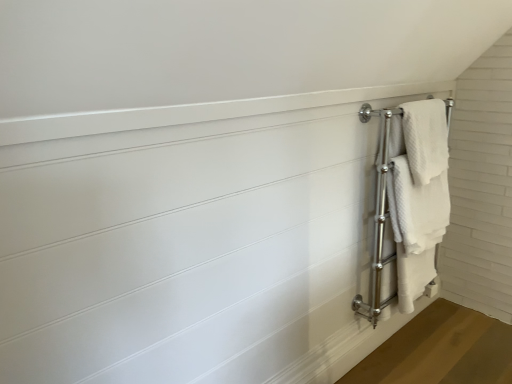
Question: From a real-world perspective, is white textured towel at right on top of white textured towel at right, which is counted as the first bath towel, starting from the bottom?

Choices:
 (A) yes
 (B) no

Answer: (A)

Question: Considering the relative sizes of white textured towel at right and white textured towel at right, which is counted as the first bath towel, starting from the bottom, in the image provided, is white textured towel at right bigger than white textured towel at right, which is counted as the first bath towel, starting from the bottom,?

Choices:
 (A) no
 (B) yes

Answer: (A)

Question: Considering the relative sizes of white textured towel at right and white textured towel at right, which is counted as the first bath towel, starting from the bottom, in the image provided, is white textured towel at right smaller than white textured towel at right, which is counted as the first bath towel, starting from the bottom,?

Choices:
 (A) no
 (B) yes

Answer: (B)

Question: Considering the relative positions of white textured towel at right and white textured towel at right, acting as the 2th bath towel starting from the top, in the image provided, is white textured towel at right to the right of white textured towel at right, acting as the 2th bath towel starting from the top, from the viewer's perspective?

Choices:
 (A) no
 (B) yes

Answer: (B)

Question: Does white textured towel at right lie in front of white textured towel at right, acting as the 2th bath towel starting from the top?

Choices:
 (A) no
 (B) yes

Answer: (A)

Question: Could you tell me if white textured towel at right is facing white textured towel at right, which is counted as the first bath towel, starting from the bottom?

Choices:
 (A) no
 (B) yes

Answer: (B)

Question: Is white textured towel at right, acting as the 2th bath towel starting from the top, not inside white textured towel at right, the second bath towel ordered from the bottom?

Choices:
 (A) yes
 (B) no

Answer: (A)

Question: From the image's perspective, does white textured towel at right, acting as the 2th bath towel starting from the top, appear higher than white textured towel at right, the 1th bath towel in the top-to-bottom sequence?

Choices:
 (A) yes
 (B) no

Answer: (B)

Question: Considering the relative positions of white textured towel at right, which is counted as the first bath towel, starting from the bottom, and white textured towel at right, the 1th bath towel in the top-to-bottom sequence, in the image provided, is white textured towel at right, which is counted as the first bath towel, starting from the bottom, behind white textured towel at right, the 1th bath towel in the top-to-bottom sequence,?

Choices:
 (A) no
 (B) yes

Answer: (A)

Question: Are white textured towel at right, which is counted as the first bath towel, starting from the bottom, and white textured towel at right, the second bath towel ordered from the bottom, making contact?

Choices:
 (A) yes
 (B) no

Answer: (B)

Question: Is white textured towel at right, the second bath towel ordered from the bottom, completely or partially inside white textured towel at right, acting as the 2th bath towel starting from the top?

Choices:
 (A) yes
 (B) no

Answer: (A)

Question: Does white textured towel at right, which is counted as the first bath towel, starting from the bottom, appear on the right side of white textured towel at right, the 1th bath towel in the top-to-bottom sequence?

Choices:
 (A) no
 (B) yes

Answer: (A)

Question: Is white textured towel at right, the second bath towel ordered from the bottom, bigger than white textured towel at right?

Choices:
 (A) yes
 (B) no

Answer: (B)